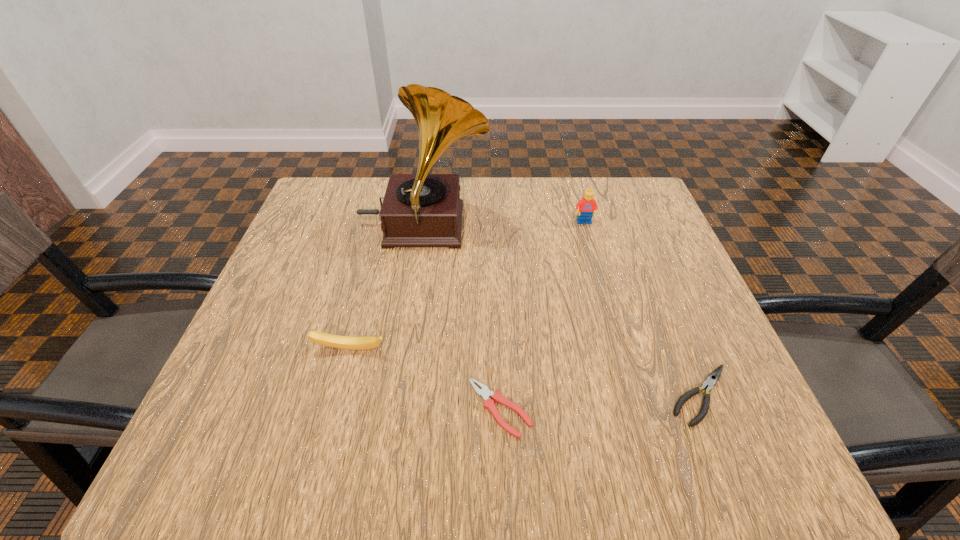
I want to click on object located at the far right corner, so click(585, 207).

Locate an element on the screen. The image size is (960, 540). object located in the near right corner section of the desktop is located at coordinates (712, 379).

I want to click on vacant region at the far edge, so click(x=509, y=198).

What are the coordinates of `vacant space at the near edge of the desktop` in the screenshot? It's located at (520, 456).

You are a GUI agent. You are given a task and a screenshot of the screen. Output one action in this format:
    pyautogui.click(x=<x>, y=<y>)
    Task: Click on the vacant space at the left edge
    Image resolution: width=960 pixels, height=540 pixels.
    Given the screenshot: What is the action you would take?
    pyautogui.click(x=340, y=231)

Image resolution: width=960 pixels, height=540 pixels. In order to click on free spot at the right edge of the desktop in this screenshot , I will do `click(665, 257)`.

Identify the location of vacant space at the far left corner of the desktop. (315, 190).

Locate an element on the screen. vacant space at the near left corner of the desktop is located at coordinates (238, 438).

The height and width of the screenshot is (540, 960). I want to click on vacant space that is in between the third farthest object and the second object from right to left, so click(467, 286).

Locate an element on the screen. This screenshot has height=540, width=960. free space between the Lego and the third nearest object is located at coordinates (467, 286).